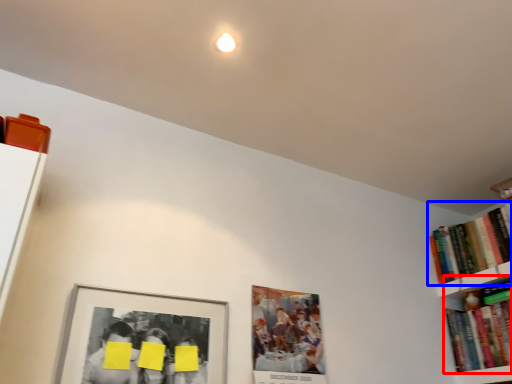
Question: Which object is further to the camera taking this photo, book (highlighted by a red box) or book (highlighted by a blue box)?

Choices:
 (A) book
 (B) book

Answer: (B)